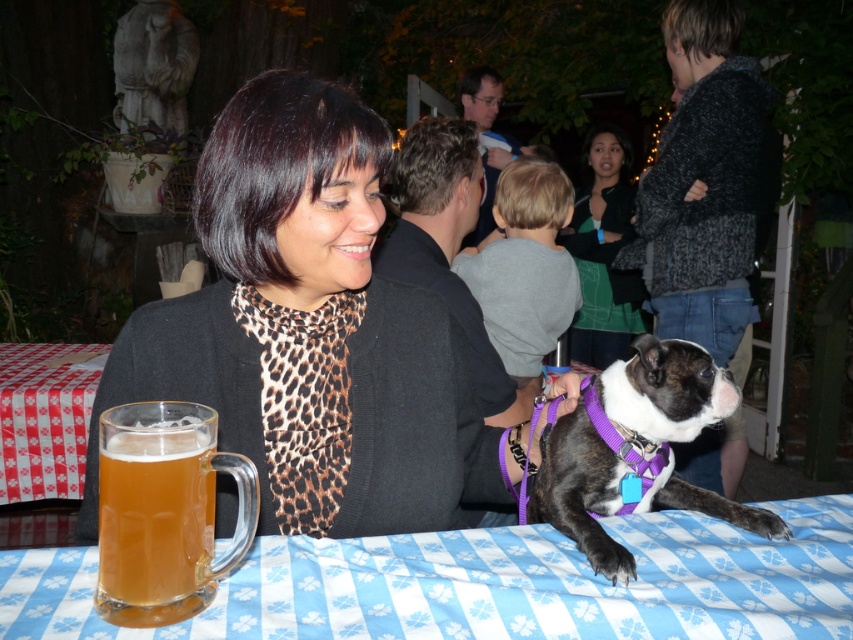
Does point (337, 221) come closer to viewer compared to point (560, 241)?

Yes, point (337, 221) is closer to viewer.

Who is taller, matte black sweater at center or leopard print scarf at center?

leopard print scarf at center

What do you see at coordinates (309, 332) in the screenshot? I see `matte black sweater at center` at bounding box center [309, 332].

Where is `matte black sweater at center`? This screenshot has width=853, height=640. matte black sweater at center is located at coordinates (309, 332).

Which is behind, point (375, 221) or point (250, 602)?

The point (375, 221) is more distant.

Measure the distance between point (265, 116) and camera.

They are 28.18 inches apart.

Does point (152, 355) come in front of point (50, 604)?

No, (152, 355) is further to viewer.

Find the location of `matte black sweater at center`. matte black sweater at center is located at coordinates (309, 332).

Is blue/white checkered tablecloth at lower center positioned behind gray cotton shirt at center?

No, it is in front of gray cotton shirt at center.

Which of these two, blue/white checkered tablecloth at lower center or gray cotton shirt at center, stands shorter?

With less height is blue/white checkered tablecloth at lower center.

This screenshot has height=640, width=853. Identify the location of blue/white checkered tablecloth at lower center. (488, 582).

This screenshot has width=853, height=640. In order to click on blue/white checkered tablecloth at lower center in this screenshot , I will do `click(488, 582)`.